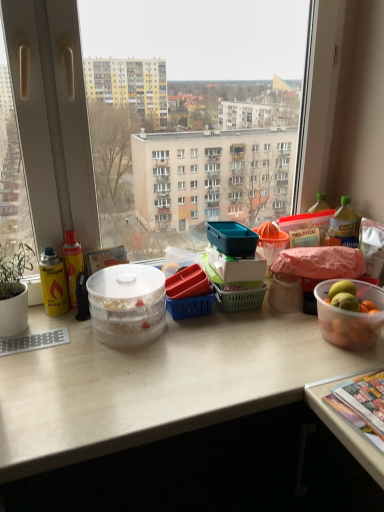
Question: Is multicolored glossy magazine at lower right inside translucent plastic bowl at right, which appears as the first bowl when viewed from the right?

Choices:
 (A) yes
 (B) no

Answer: (B)

Question: From a real-world perspective, is translucent plastic bowl at right, which appears as the first bowl when viewed from the right, positioned over multicolored glossy magazine at lower right based on gravity?

Choices:
 (A) no
 (B) yes

Answer: (B)

Question: From the image's perspective, does translucent plastic bowl at right, acting as the 2th bowl starting from the left, appear lower than multicolored glossy magazine at lower right?

Choices:
 (A) yes
 (B) no

Answer: (B)

Question: Can you confirm if translucent plastic bowl at right, acting as the 2th bowl starting from the left, is thinner than multicolored glossy magazine at lower right?

Choices:
 (A) yes
 (B) no

Answer: (A)

Question: Are translucent plastic bowl at right, which appears as the first bowl when viewed from the right, and multicolored glossy magazine at lower right making contact?

Choices:
 (A) yes
 (B) no

Answer: (B)

Question: In the image, is clear plastic bottle at right on the left side or the right side of translucent plastic bowl at right, acting as the 2th bowl starting from the left?

Choices:
 (A) left
 (B) right

Answer: (B)

Question: From their relative heights in the image, would you say clear plastic bottle at right is taller or shorter than translucent plastic bowl at right, which appears as the first bowl when viewed from the right?

Choices:
 (A) tall
 (B) short

Answer: (B)

Question: Considering the positions of clear plastic bottle at right and translucent plastic bowl at right, acting as the 2th bowl starting from the left, in the image, is clear plastic bottle at right bigger or smaller than translucent plastic bowl at right, acting as the 2th bowl starting from the left,?

Choices:
 (A) small
 (B) big

Answer: (A)

Question: Does point (327, 242) appear closer or farther from the camera than point (382, 298)?

Choices:
 (A) closer
 (B) farther

Answer: (B)

Question: Considering the positions of transparent glass window at center and white matte desk at center in the image, is transparent glass window at center wider or thinner than white matte desk at center?

Choices:
 (A) thin
 (B) wide

Answer: (A)

Question: Which is correct: transparent glass window at center is inside white matte desk at center, or outside of it?

Choices:
 (A) outside
 (B) inside

Answer: (A)

Question: In terms of size, does transparent glass window at center appear bigger or smaller than white matte desk at center?

Choices:
 (A) big
 (B) small

Answer: (B)

Question: From their relative heights in the image, would you say transparent glass window at center is taller or shorter than white matte desk at center?

Choices:
 (A) tall
 (B) short

Answer: (B)

Question: Looking at the image, does white matte desk at center seem bigger or smaller compared to clear plastic bottle at right?

Choices:
 (A) small
 (B) big

Answer: (B)

Question: From the image's perspective, is white matte desk at center above or below clear plastic bottle at right?

Choices:
 (A) above
 (B) below

Answer: (B)